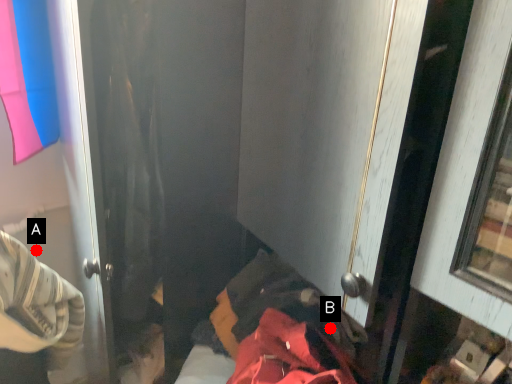
Question: Two points are circled on the image, labeled by A and B beside each circle. Which point is farther to the camera?

Choices:
 (A) A is further
 (B) B is further

Answer: (A)